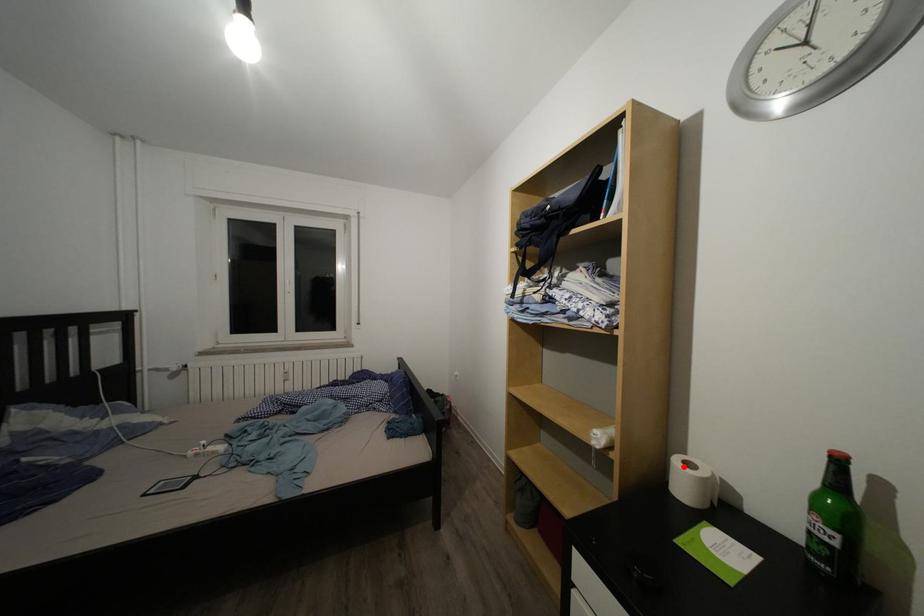
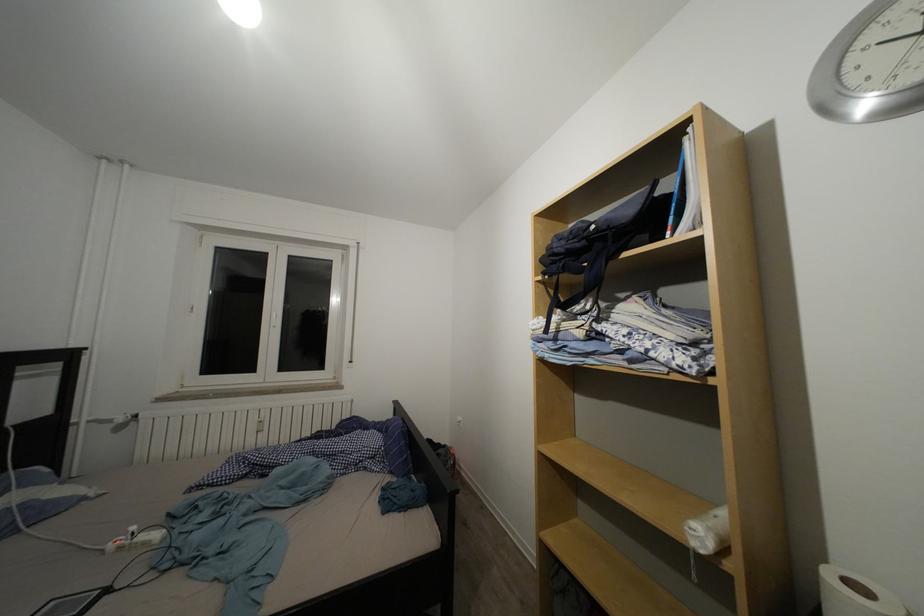
In the second image, find the point that corresponds to the highlighted location in the first image.

(837, 584)